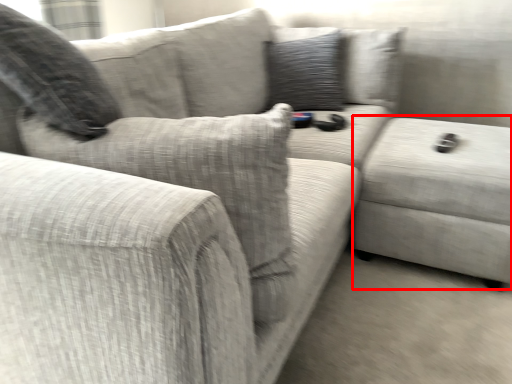
Question: From the image's perspective, considering the relative positions of gray (annotated by the red box) and pillow in the image provided, where is gray (annotated by the red box) located with respect to the staircase?

Choices:
 (A) above
 (B) below

Answer: (B)